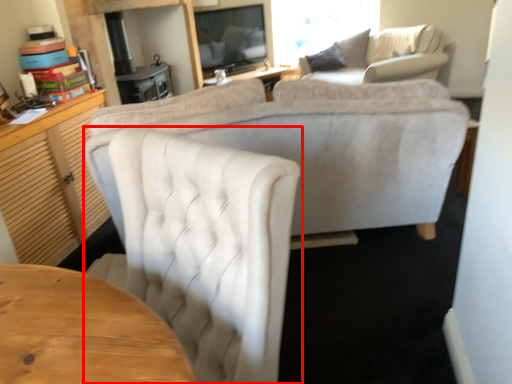
Question: Where is chair (annotated by the red box) located in relation to studio couch in the image?

Choices:
 (A) left
 (B) right

Answer: (A)